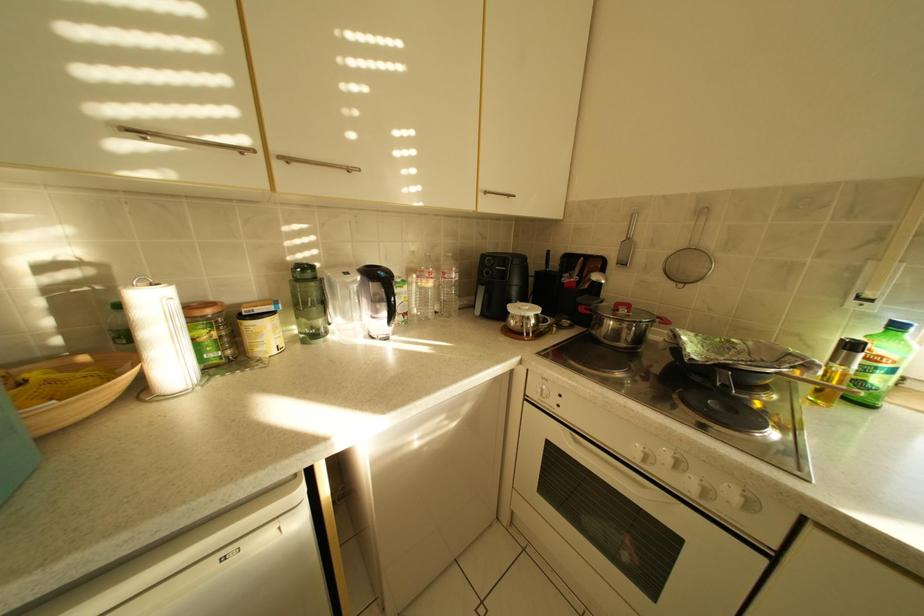
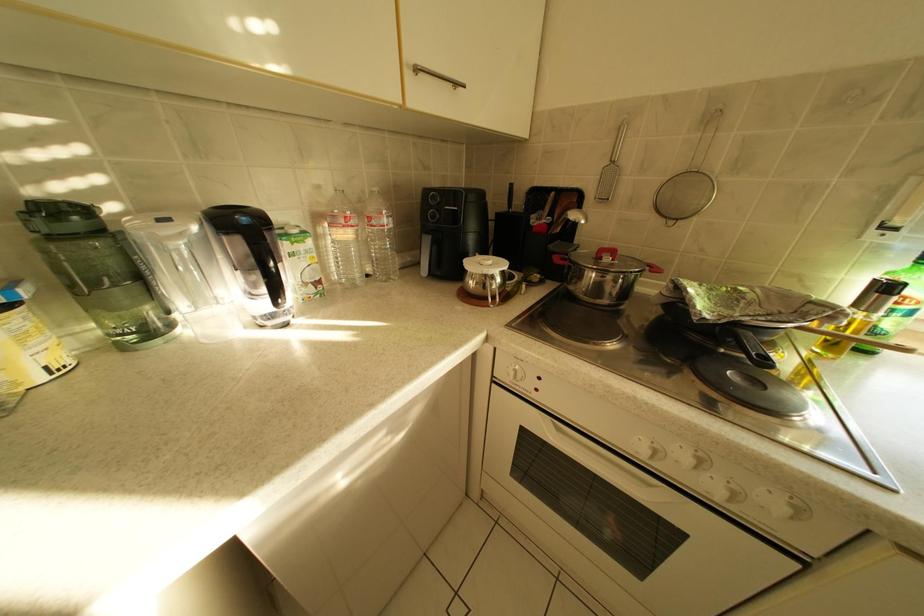
Question: The images are taken continuously from a first-person perspective. In which direction are you moving?

Choices:
 (A) Left
 (B) Right
 (C) Forward
 (D) Backward

Answer: (C)